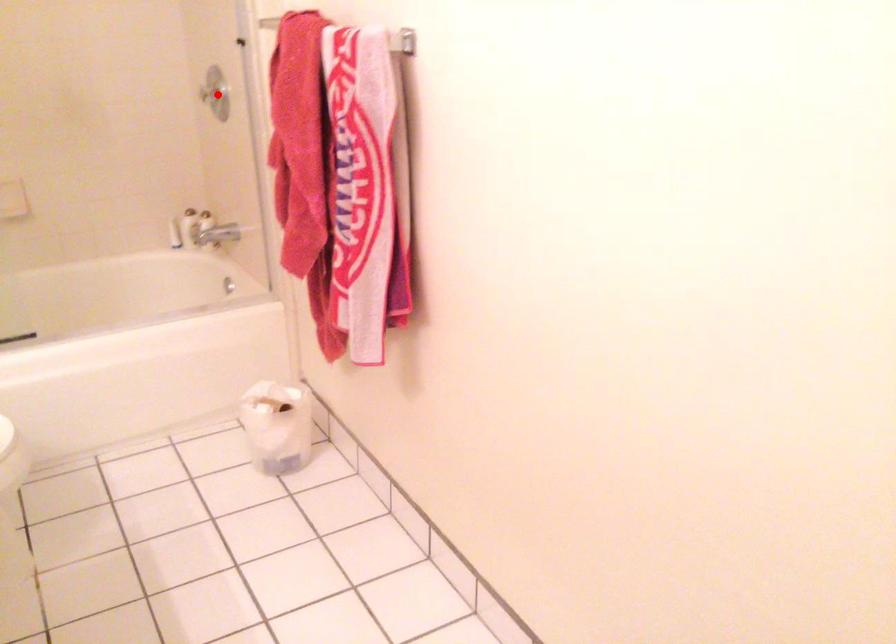
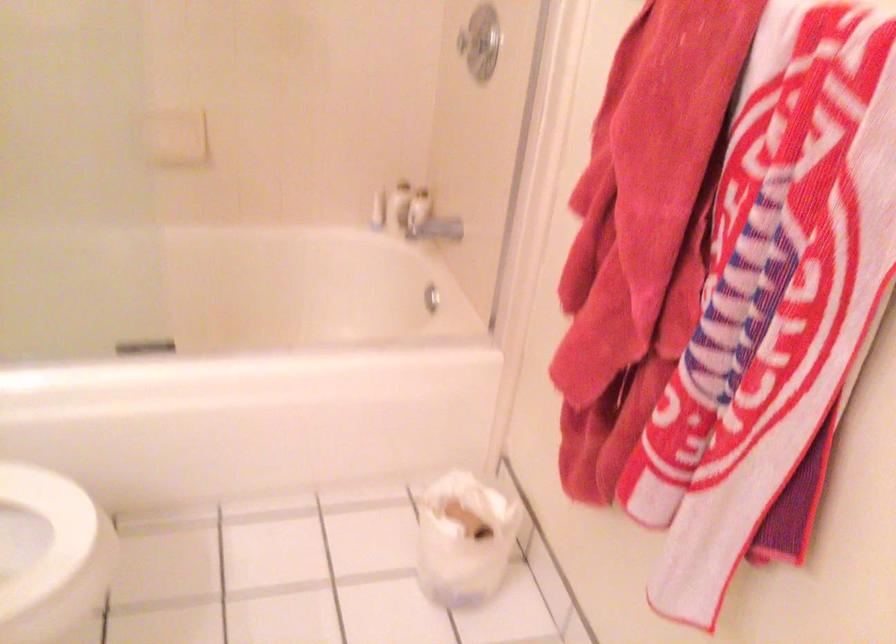
Question: I am providing you with two images of the same scene from different viewpoints. Image1 has a red point marked. In image2, the corresponding 3D location appears at what relative position? Reply with the corresponding letter.

Choices:
 (A) Closer
 (B) Farther

Answer: (A)